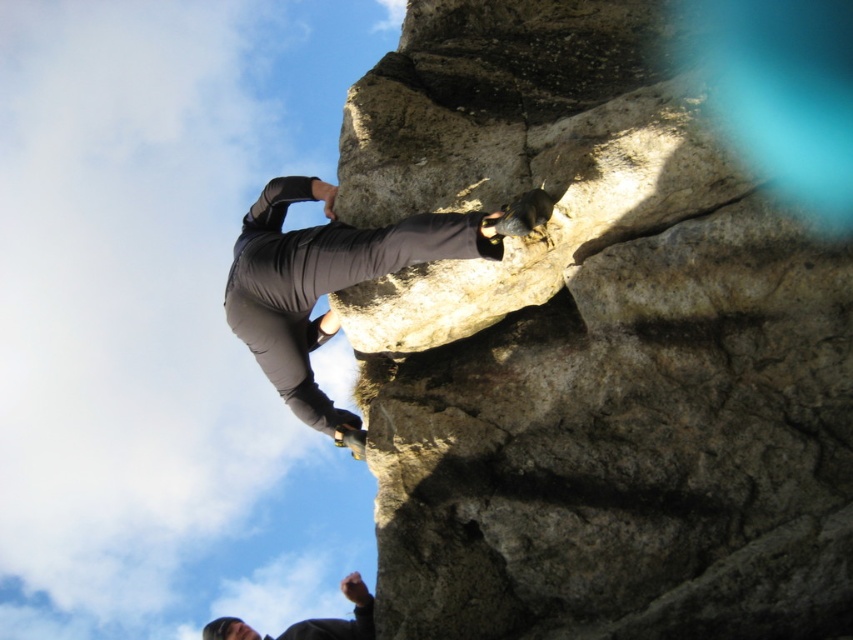
Based on the photo, you are a photographer positioned below the climber. You want to capture a photo where the rough stone cliff at center and the gray matte pants at center are both clearly visible. Which object should you focus on to ensure both are in sharp focus?

The rough stone cliff at center is in front of gray matte pants at center, so focusing on the rough stone cliff at center will ensure both are in sharp focus because it is closer to the camera.

Looking at this image, you are a photographer planning to take a wide shot of the scene. Given that the rough stone cliff at center and the dark gray fabric pants at upper center are both in the frame, which object will occupy more of the photo?

The dark gray fabric pants at upper center occupy more space in the photo than the rough stone cliff at center, as per the description.

Based on the photo, you are a photographer aiming to capture the rock climber in the image. You want to ensure both the rough stone cliff at center and the dark gray fabric pants at upper center are clearly visible in your shot. Which object should you focus on first to ensure proper depth of field?

The rough stone cliff at center has a lesser width compared to dark gray fabric pants at upper center. Therefore, you should focus on the rough stone cliff at center first because it is smaller in width and adjusting the depth of field starting from the smaller object ensures both are in focus.